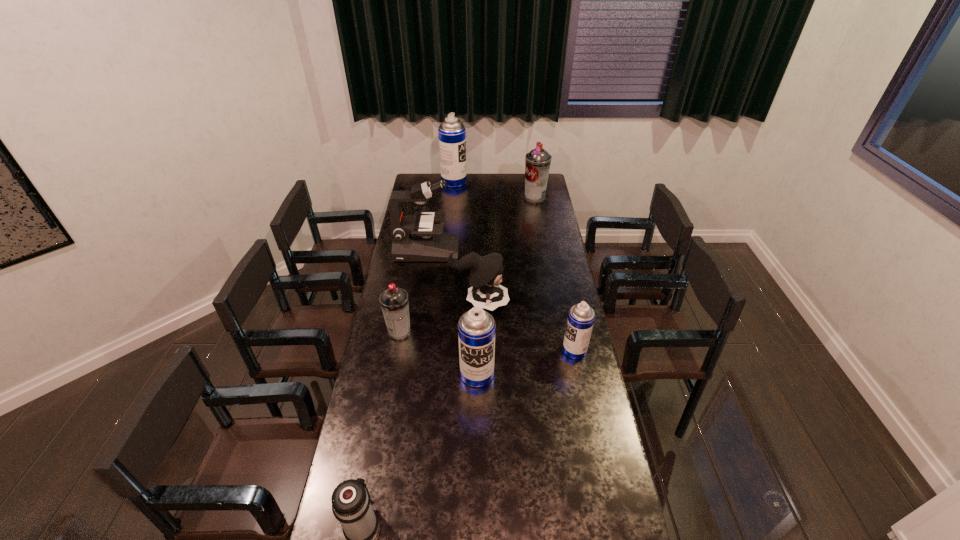
This screenshot has height=540, width=960. In order to click on the leftmost blue aerosol can in this screenshot , I will do `click(452, 134)`.

This screenshot has height=540, width=960. Identify the location of the second aerosol can from left to right. pos(452,134).

Where is `the sixth nearest object`? the sixth nearest object is located at coordinates (415, 238).

Find the location of a particular element. Image resolution: width=960 pixels, height=540 pixels. the second farthest object is located at coordinates (537, 162).

Where is `the bigger gray aerosol can`? the bigger gray aerosol can is located at coordinates (537, 162).

This screenshot has height=540, width=960. In order to click on the third aerosol can from right to left in this screenshot , I will do `click(476, 328)`.

Where is `the seventh farthest object`? This screenshot has height=540, width=960. the seventh farthest object is located at coordinates [476, 328].

Where is `the fifth nearest object`? the fifth nearest object is located at coordinates (487, 270).

Where is `the smallest blue aerosol can`? The image size is (960, 540). the smallest blue aerosol can is located at coordinates (581, 316).

You are a GUI agent. You are given a task and a screenshot of the screen. Output one action in this format:
    pyautogui.click(x=<x>, y=<y>)
    Task: Click on the rightmost blue aerosol can
    This screenshot has width=960, height=540.
    Given the screenshot: What is the action you would take?
    pyautogui.click(x=581, y=316)